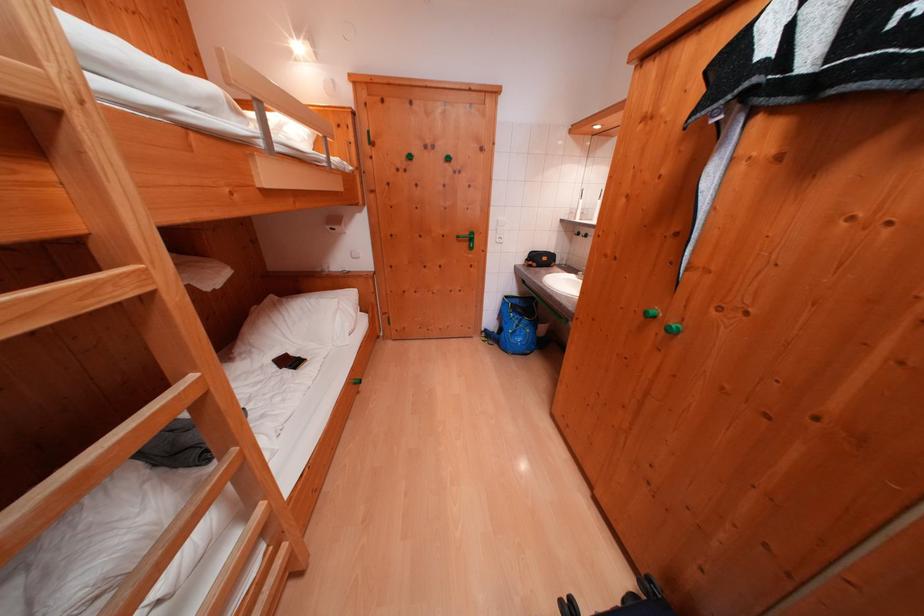
What do you see at coordinates (468, 238) in the screenshot?
I see `the green drawer pull` at bounding box center [468, 238].